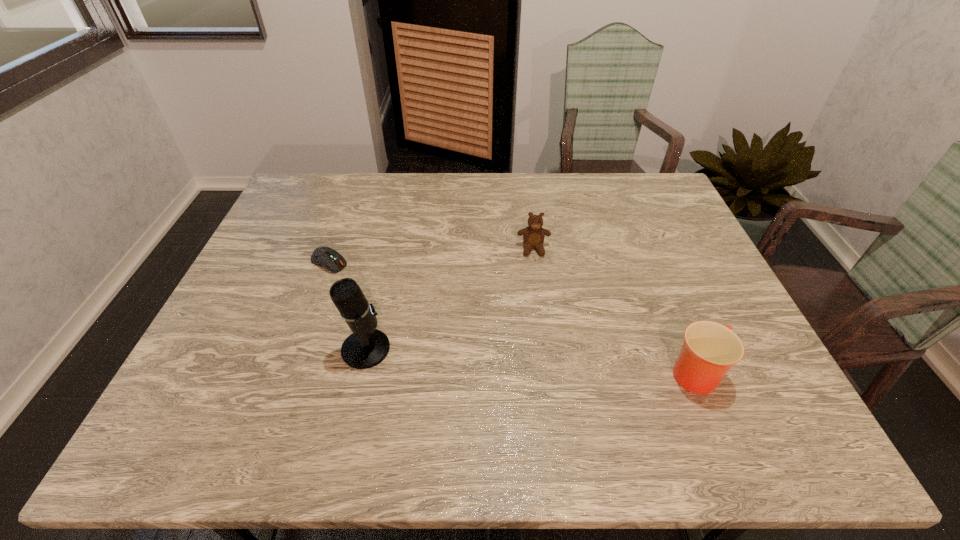
Where is `vacant space on the desktop that is between the microphone and the cup and is positioned on the button of the computer equipment`? Image resolution: width=960 pixels, height=540 pixels. vacant space on the desktop that is between the microphone and the cup and is positioned on the button of the computer equipment is located at coordinates click(480, 357).

Find the location of a particular element. This screenshot has width=960, height=540. vacant space on the desktop that is between the tallest object and the rightmost object and is positioned at the face of the teddy bear is located at coordinates (544, 362).